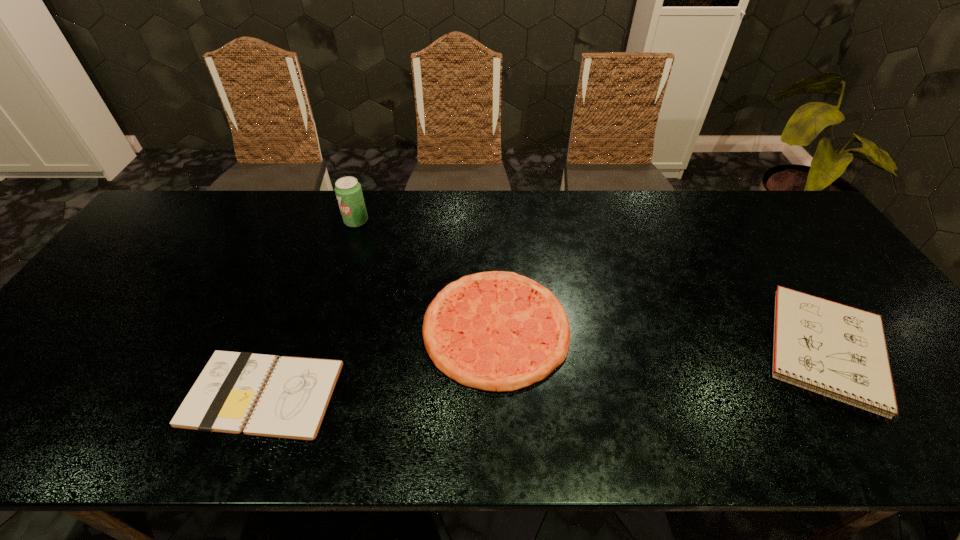
Find the location of a particular element. This screenshot has width=960, height=540. vacant space located 0.370m on the right of the pizza is located at coordinates (714, 327).

Locate an element on the screen. The image size is (960, 540). free space located on the left of the shorter notepad is located at coordinates (144, 394).

Identify the location of object that is at the far edge. This screenshot has width=960, height=540. (348, 190).

The height and width of the screenshot is (540, 960). Identify the location of object at the right edge. (835, 350).

This screenshot has height=540, width=960. I want to click on object that is at the near right corner, so click(835, 350).

This screenshot has width=960, height=540. I want to click on vacant space at the far edge, so click(197, 232).

Identify the location of vacant point at the near edge. (591, 428).

In the image, there is a desktop. At what (x,y) coordinates should I click in order to perform the action: click on vacant space at the left edge. Please return your answer as a coordinate pair (x, y). Looking at the image, I should click on (163, 240).

You are a GUI agent. You are given a task and a screenshot of the screen. Output one action in this format:
    pyautogui.click(x=<x>, y=<y>)
    Task: Click on the free space at the right edge of the desktop
    The height and width of the screenshot is (540, 960).
    Given the screenshot: What is the action you would take?
    pyautogui.click(x=795, y=258)

I want to click on vacant region at the near right corner, so click(x=918, y=418).